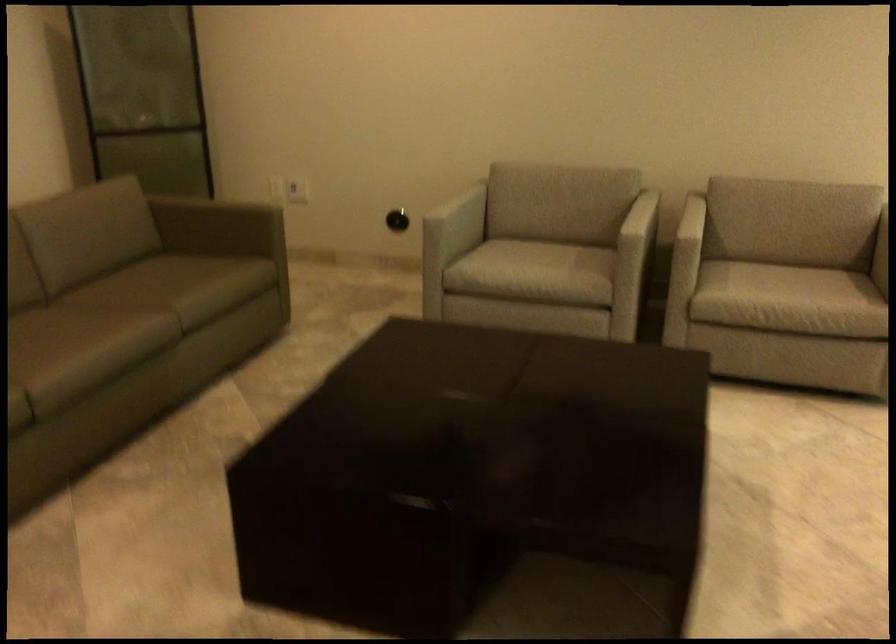
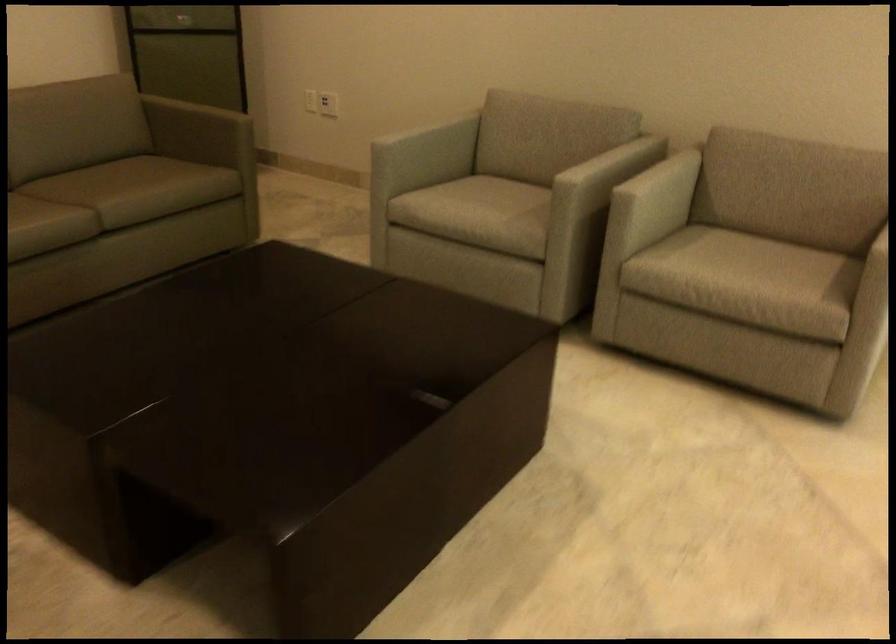
Question: The images are taken continuously from a first-person perspective. In which direction are you moving?

Choices:
 (A) Left
 (B) Right
 (C) Forward
 (D) Backward

Answer: (B)